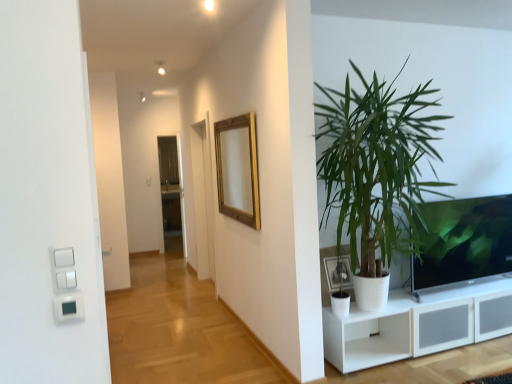
Question: Relative to gold wooden mirror at upper center, is white plastic light switch at lower left in front or behind?

Choices:
 (A) front
 (B) behind

Answer: (A)

Question: Is white plastic light switch at lower left bigger or smaller than gold wooden mirror at upper center?

Choices:
 (A) big
 (B) small

Answer: (B)

Question: Estimate the real-world distances between objects in this image. Which object is farther from the matte black tv at right?

Choices:
 (A) gold wooden mirror at upper center
 (B) transparent glass door at center
 (C) white plastic light switch at lower left
 (D) matte black picture frame at lower right
 (E) green leafy plant at right

Answer: (B)

Question: Estimate the real-world distances between objects in this image. Which object is closer to the transparent glass door at center?

Choices:
 (A) matte black tv at right
 (B) gold wooden mirror at upper center
 (C) green leafy plant at right
 (D) white plastic light switch at lower left
 (E) matte black picture frame at lower right

Answer: (B)